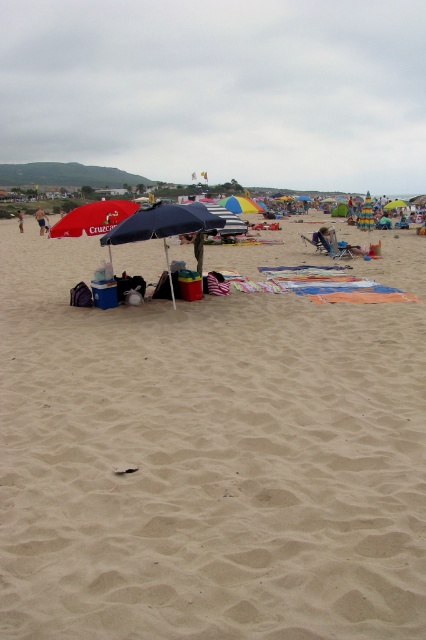
Question: Among these objects, which one is farthest from the camera?

Choices:
 (A) rainbow striped umbrella at center
 (B) multicolored fabric umbrella at center
 (C) smooth tan sand at center
 (D) beige sand at center

Answer: (D)

Question: Can you confirm if rainbow striped umbrella at center is wider than multicolored fabric umbrella at center?

Choices:
 (A) no
 (B) yes

Answer: (A)

Question: Is smooth tan sand at center positioned before matte blue umbrella at center?

Choices:
 (A) yes
 (B) no

Answer: (A)

Question: Is rainbow striped umbrella at center behind tan skin person at center?

Choices:
 (A) yes
 (B) no

Answer: (B)

Question: Which object is farther from the camera taking this photo?

Choices:
 (A) beige sand at center
 (B) matte blue umbrella at center

Answer: (A)

Question: Which object is the farthest from the rainbow striped umbrella at center?

Choices:
 (A) matte blue umbrella at center
 (B) smooth tan sand at center

Answer: (A)